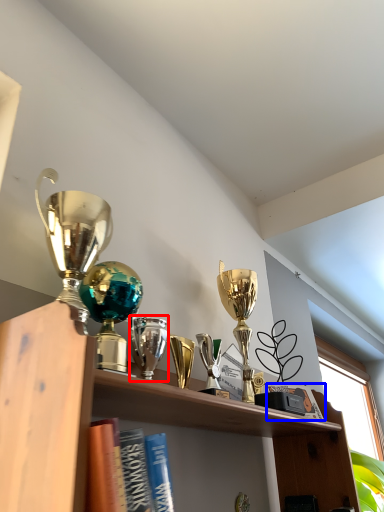
Question: Which object is further to the camera taking this photo, trophy (highlighted by a red box) or book (highlighted by a blue box)?

Choices:
 (A) trophy
 (B) book

Answer: (B)